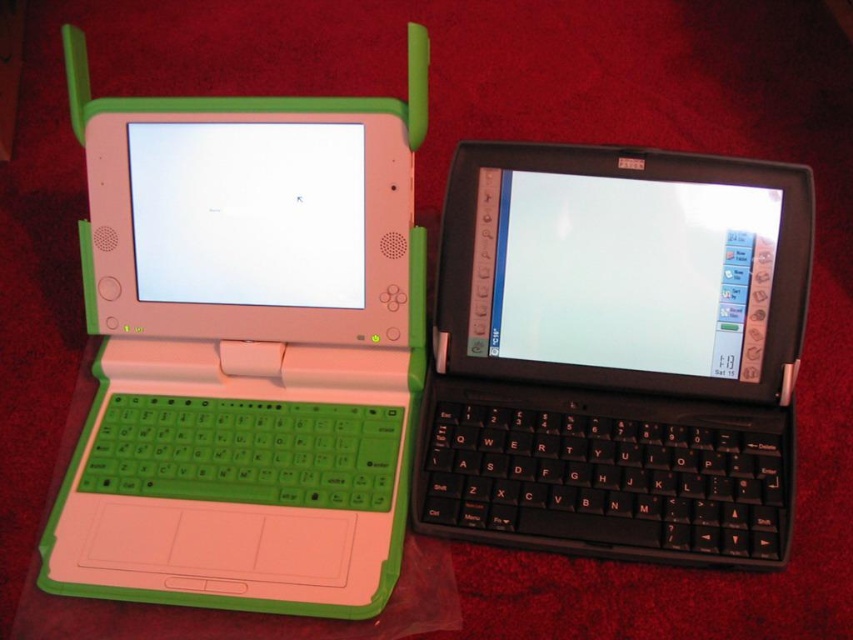
Question: Is green matte laptop at left wider than black matte keyboard at center?

Choices:
 (A) no
 (B) yes

Answer: (A)

Question: Is green matte laptop at left wider than black matte keyboard at center?

Choices:
 (A) no
 (B) yes

Answer: (A)

Question: Does green matte laptop at left appear under black matte keyboard at center?

Choices:
 (A) yes
 (B) no

Answer: (B)

Question: Which point appears farthest from the camera in this image?

Choices:
 (A) (717, 493)
 (B) (76, 563)

Answer: (A)

Question: Among these points, which one is nearest to the camera?

Choices:
 (A) (637, 397)
 (B) (186, 470)

Answer: (B)